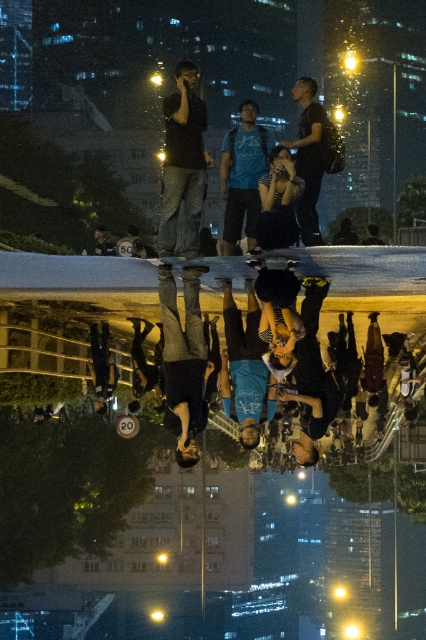
Question: Which point is farther from the camera taking this photo?

Choices:
 (A) (190, 100)
 (B) (207, 371)

Answer: (A)

Question: Is dark brown leather skateboard at center to the left of matte black phone at center from the viewer's perspective?

Choices:
 (A) yes
 (B) no

Answer: (B)

Question: Is dark brown leather skateboard at center to the right of matte black phone at center from the viewer's perspective?

Choices:
 (A) no
 (B) yes

Answer: (B)

Question: Observing the image, what is the correct spatial positioning of dark brown leather skateboard at center in reference to matte black phone at center?

Choices:
 (A) left
 (B) right

Answer: (B)

Question: Which of the following is the farthest from the observer?

Choices:
 (A) matte black phone at center
 (B) dark brown leather skateboard at center

Answer: (A)

Question: Which object is farther from the camera taking this photo?

Choices:
 (A) dark brown leather skateboard at center
 (B) matte black phone at center

Answer: (B)